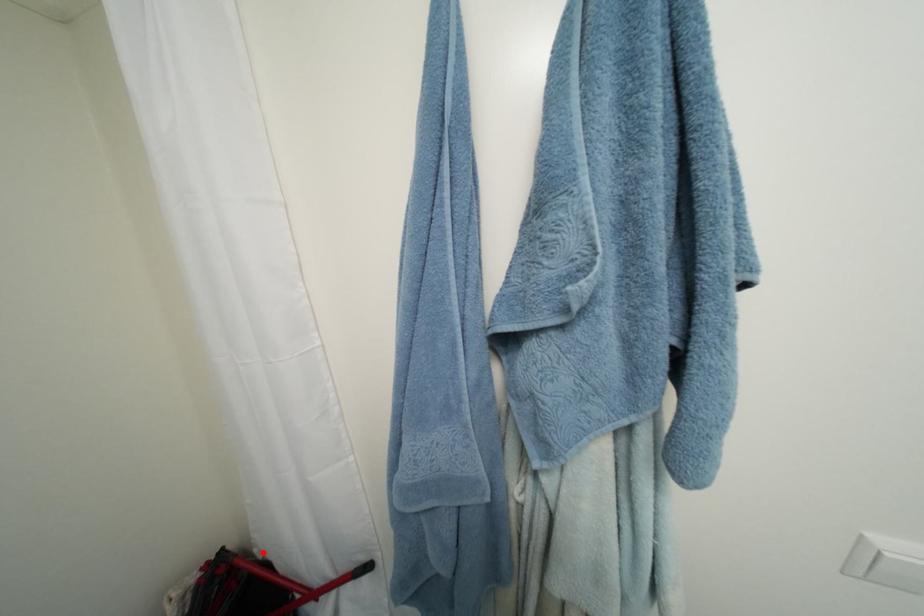
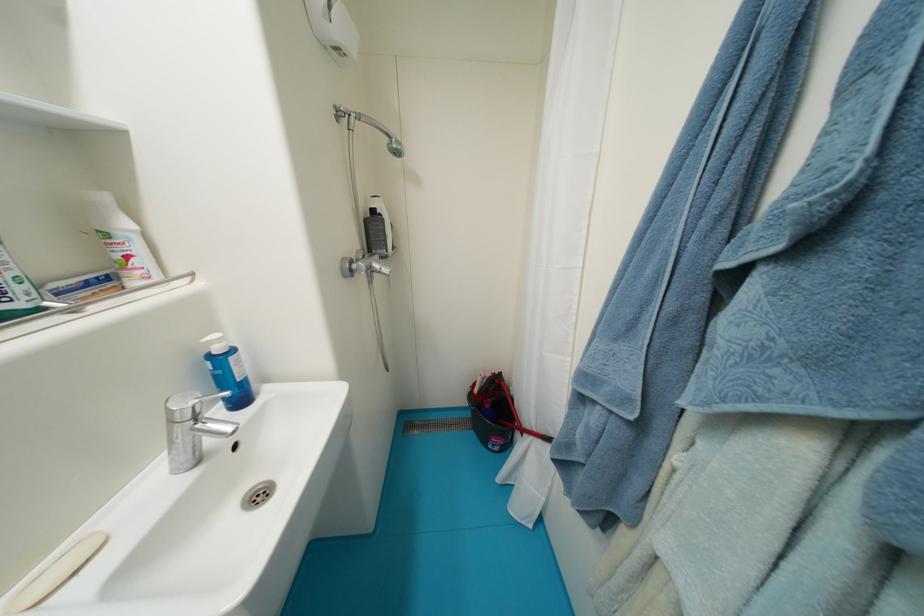
Locate, in the second image, the point that corresponds to the highlighted location in the first image.

(517, 390)